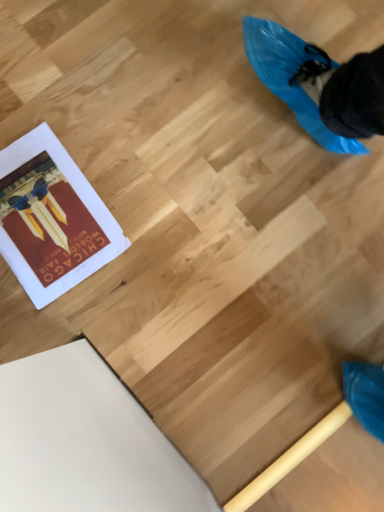
At what (x,y) coordinates should I click in order to perform the action: click on vacant area that is in front of matte paper poster at lower left. Please return your answer as a coordinate pair (x, y). This screenshot has height=512, width=384. Looking at the image, I should click on pyautogui.click(x=65, y=324).